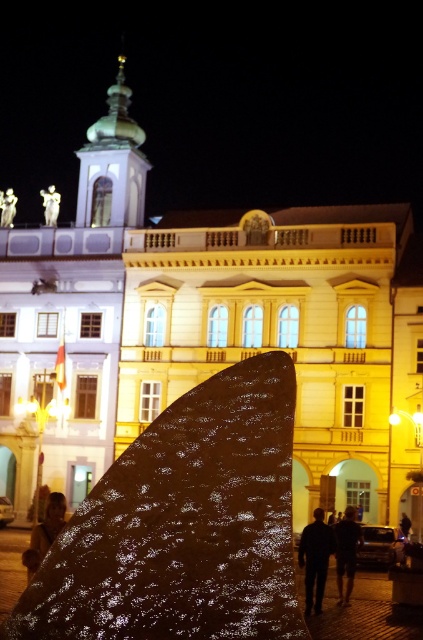
Which is below, dark blue jeans at lower center or white marble statue at upper left?

dark blue jeans at lower center

Can you confirm if dark blue jeans at lower center is taller than white marble statue at upper left?

Correct, dark blue jeans at lower center is much taller as white marble statue at upper left.

Find the location of a particular element. Image resolution: width=423 pixels, height=640 pixels. dark blue jeans at lower center is located at coordinates (315, 557).

Measure the distance from dark blue jeans at lower center to dark fabric pants at lower center.

dark blue jeans at lower center and dark fabric pants at lower center are 6.55 feet apart from each other.

Between dark blue jeans at lower center and dark fabric pants at lower center, which one appears on the right side from the viewer's perspective?

Positioned to the right is dark fabric pants at lower center.

This screenshot has height=640, width=423. In order to click on dark blue jeans at lower center in this screenshot , I will do `click(315, 557)`.

Is dark fabric pants at lower center above brown leather jacket at lower left?

No, dark fabric pants at lower center is not above brown leather jacket at lower left.

Where is `dark fabric pants at lower center`? This screenshot has width=423, height=640. dark fabric pants at lower center is located at coordinates (346, 552).

Is point (351, 548) behind point (29, 563)?

Yes, point (351, 548) is behind point (29, 563).

Image resolution: width=423 pixels, height=640 pixels. I want to click on dark fabric pants at lower center, so click(x=346, y=552).